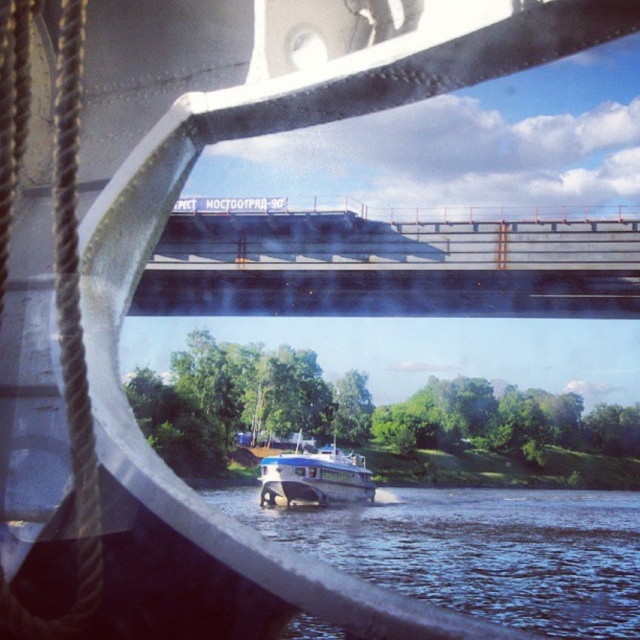
You are navigating a boat and need to pass under the concrete bridge at center. The boat has a height of 0.5 meters. Can you safely pass under the bridge based on its position?

The concrete bridge at center is positioned at point (390,266). Since the boat has a height of 0.5 meters, and the bridge is at a higher elevation, it should be safe to pass under the bridge.

You are an observer inside the boat looking through the window. You notice the blue water at lower center and the blue glossy boat at center. Which object takes up more space in your view?

The blue water at lower center takes up more space in the view as it is bigger than the blue glossy boat at center.